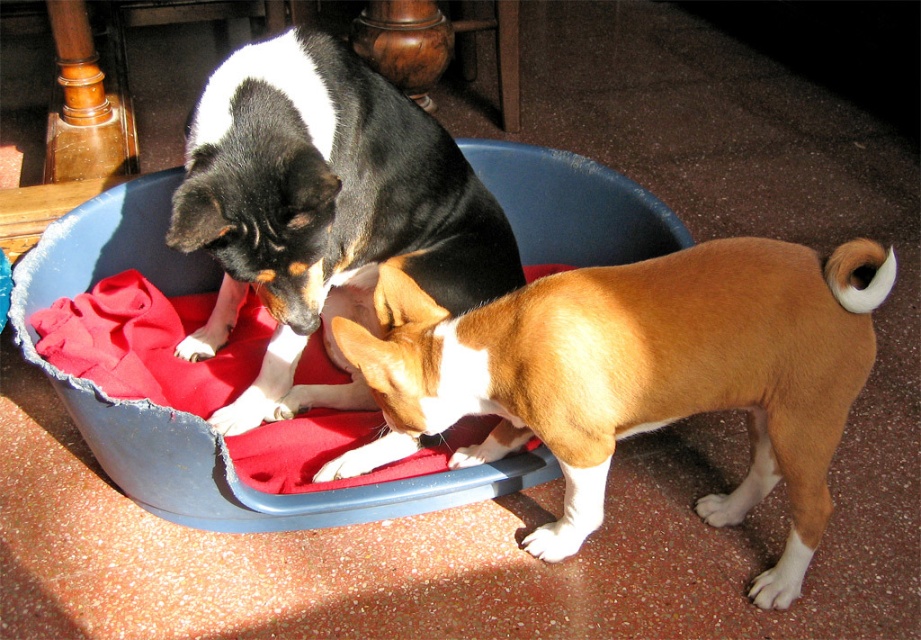
You are standing in front of the blue plastic tub with red fabric. There are two points marked in the scene. Which point, point (665, 342) or point (385, 326), is closer to you?

Point (665, 342) is closer to the camera than point (385, 326).